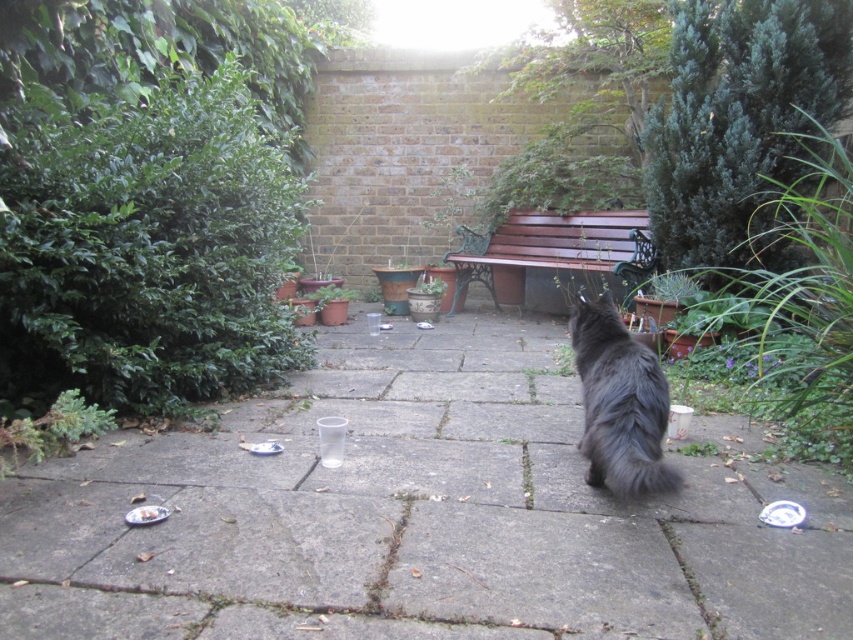
Question: Can you confirm if black fluffy cat at center is positioned to the left of wooden bench at center?

Choices:
 (A) no
 (B) yes

Answer: (B)

Question: Which of the following is the closest to the observer?

Choices:
 (A) wooden bench at center
 (B) black fluffy cat at center

Answer: (B)

Question: Is black fluffy cat at center positioned at the back of wooden bench at center?

Choices:
 (A) yes
 (B) no

Answer: (B)

Question: Which point is closer to the camera taking this photo?

Choices:
 (A) click(x=543, y=211)
 (B) click(x=637, y=360)

Answer: (B)

Question: Which of the following is the closest to the observer?

Choices:
 (A) (587, 253)
 (B) (633, 372)

Answer: (B)

Question: Does black fluffy cat at center have a smaller size compared to wooden bench at center?

Choices:
 (A) no
 (B) yes

Answer: (B)